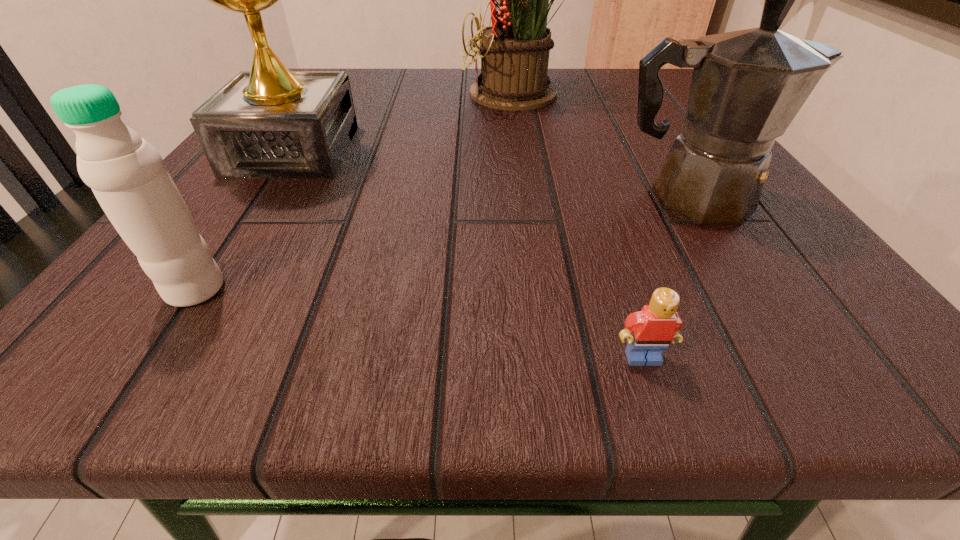
Where is `vacant space located 0.070m on the front-facing side of the fourth shortest object`? vacant space located 0.070m on the front-facing side of the fourth shortest object is located at coordinates (254, 209).

Locate an element on the screen. The width and height of the screenshot is (960, 540). free location located on the right of the water bottle is located at coordinates (477, 289).

At what (x,y) coordinates should I click in order to perform the action: click on object that is at the far edge. Please return your answer as a coordinate pair (x, y). Looking at the image, I should click on (514, 51).

Identify the location of water bottle situated at the near edge. (127, 175).

I want to click on Lego at the near edge, so click(x=654, y=327).

Where is `award at the left edge`? award at the left edge is located at coordinates (269, 122).

The image size is (960, 540). Find the location of `water bottle present at the left edge`. water bottle present at the left edge is located at coordinates (127, 175).

Locate an element on the screen. The width and height of the screenshot is (960, 540). object that is at the right edge is located at coordinates (747, 86).

Locate an element on the screen. This screenshot has height=540, width=960. object located at the near left corner is located at coordinates (127, 175).

What are the coordinates of `vacant point at the far edge` in the screenshot? It's located at point(468,80).